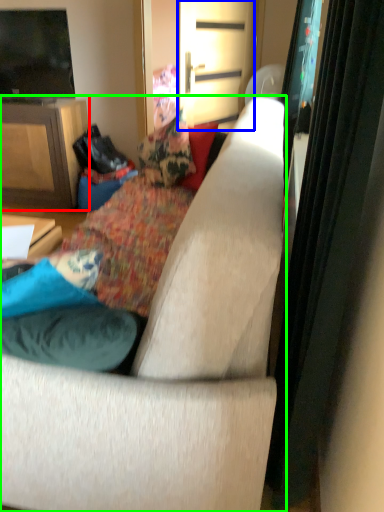
Question: Which is farther away from cabinetry (highlighted by a red box)? screen door (highlighted by a blue box) or studio couch (highlighted by a green box)?

Choices:
 (A) screen door
 (B) studio couch

Answer: (B)